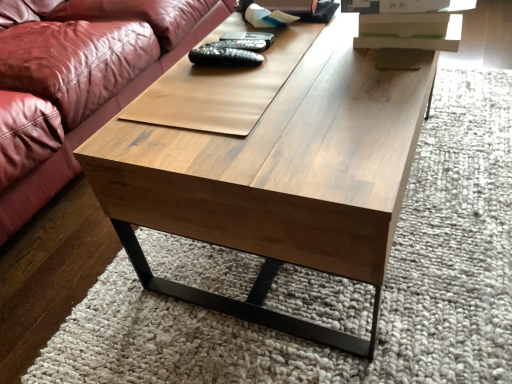
What are the coordinates of `vacant point to the left of black matte remote at center, positioned as the second remote in bottom-to-top order` in the screenshot? It's located at (172, 80).